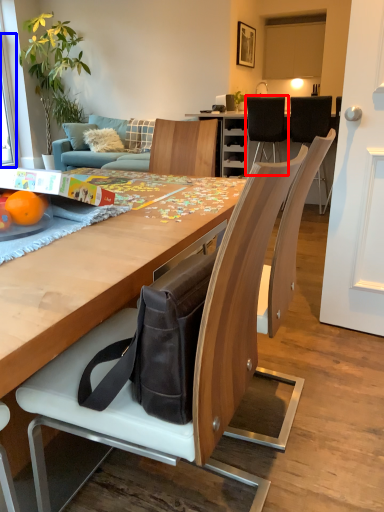
Question: Which of the following is the farthest to the observer, chair (highlighted by a red box) or window screen (highlighted by a blue box)?

Choices:
 (A) chair
 (B) window screen

Answer: (B)